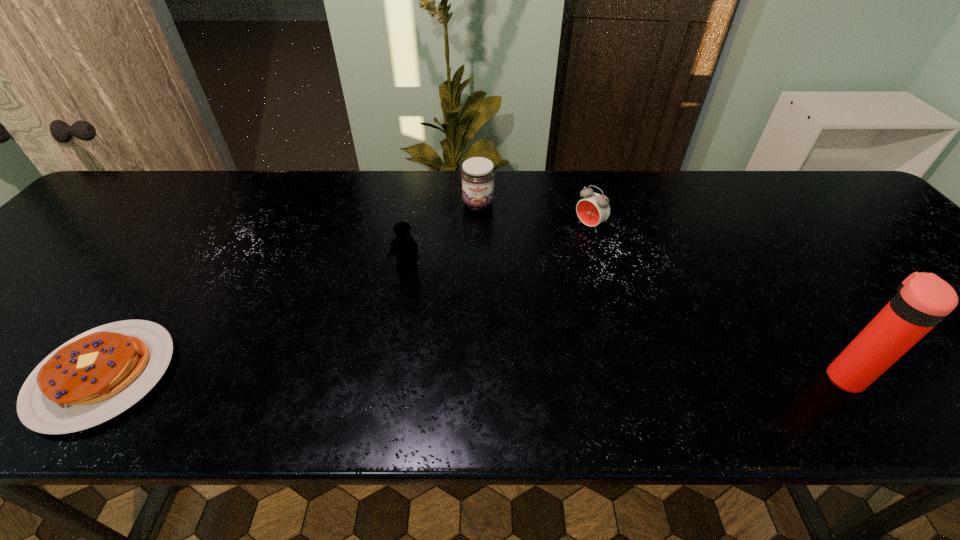
Identify the location of vacant space on the desktop that is between the shortest object and the rightmost object and is positioned on the front-facing side of the third farthest object. Image resolution: width=960 pixels, height=540 pixels. (375, 375).

The width and height of the screenshot is (960, 540). I want to click on free space on the desktop that is between the pancake and the thermos bottle and is positioned on the front label of the farthest object, so pos(495,376).

Locate an element on the screen. free space on the desktop that is between the shortest object and the rightmost object and is positioned on the face of the fourth nearest object is located at coordinates (375, 375).